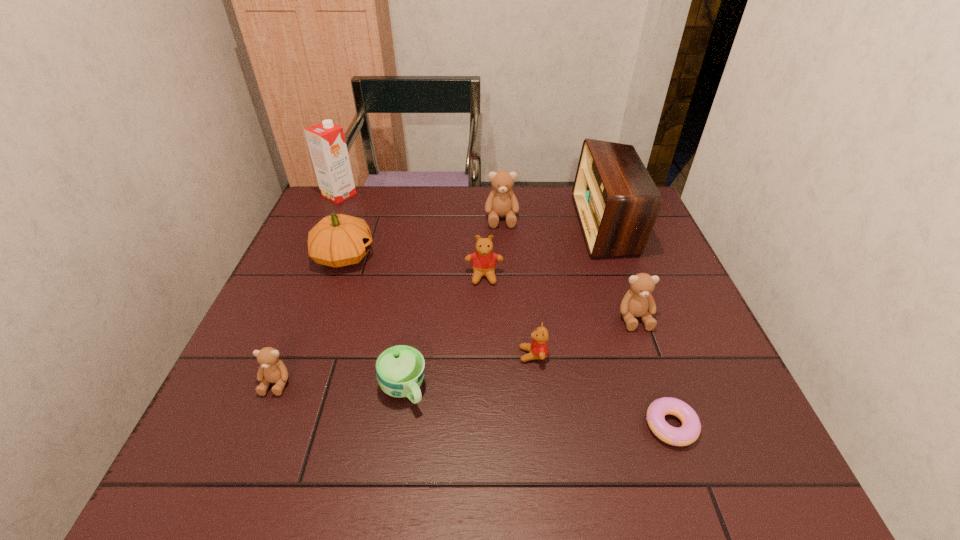
I want to click on carton that is at the far edge, so click(326, 141).

In order to click on radio receiver at the far edge in this screenshot , I will do `click(617, 202)`.

Where is `teddy bear at the far edge`? The width and height of the screenshot is (960, 540). teddy bear at the far edge is located at coordinates (501, 202).

You are a GUI agent. You are given a task and a screenshot of the screen. Output one action in this format:
    pyautogui.click(x=<x>, y=<y>)
    Task: Click on the object that is at the near edge
    This screenshot has width=960, height=540.
    Given the screenshot: What is the action you would take?
    pyautogui.click(x=688, y=433)

You are a GUI agent. You are given a task and a screenshot of the screen. Output one action in this format:
    pyautogui.click(x=<x>, y=<y>)
    Task: Click on the carton positioned at the left edge
    This screenshot has height=540, width=960.
    Given the screenshot: What is the action you would take?
    pyautogui.click(x=326, y=141)

The image size is (960, 540). What are the coordinates of `gourd that is at the left edge` in the screenshot? It's located at click(338, 240).

Locate an element on the screen. The width and height of the screenshot is (960, 540). teddy bear present at the left edge is located at coordinates (272, 370).

This screenshot has height=540, width=960. In order to click on radio receiver located in the right edge section of the desktop in this screenshot , I will do `click(617, 202)`.

You are a GUI agent. You are given a task and a screenshot of the screen. Output one action in this format:
    pyautogui.click(x=<x>, y=<y>)
    Task: Click on the teddy bear at the right edge
    The height and width of the screenshot is (540, 960).
    Given the screenshot: What is the action you would take?
    pyautogui.click(x=638, y=301)

I want to click on doughnut that is positioned at the right edge, so click(688, 433).